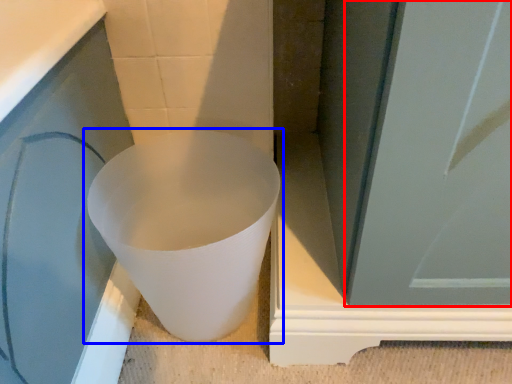
Question: Among these objects, which one is farthest to the camera, screen door (highlighted by a red box) or toilet (highlighted by a blue box)?

Choices:
 (A) screen door
 (B) toilet

Answer: (B)